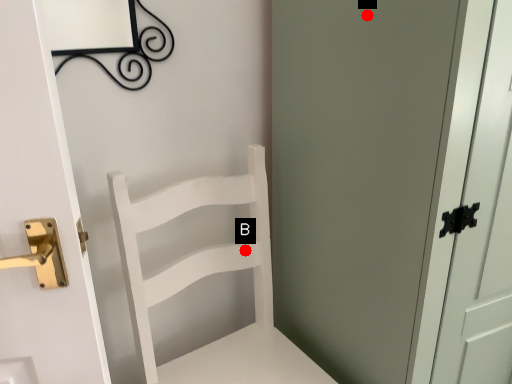
Question: Two points are circled on the image, labeled by A and B beside each circle. Which of the following is the farthest from the observer?

Choices:
 (A) A is further
 (B) B is further

Answer: (B)